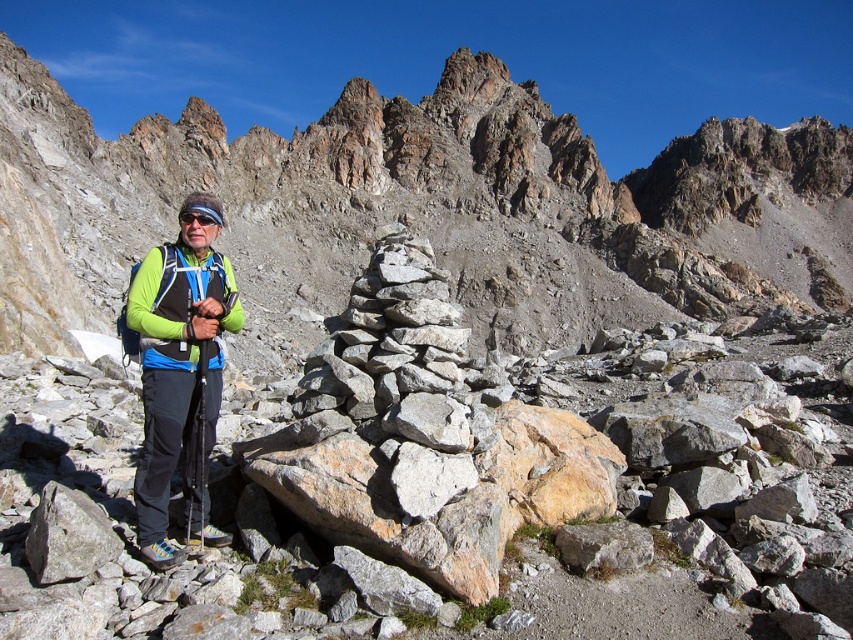
Who is more forward, (212, 262) or (184, 220)?

Point (184, 220) is in front.

I want to click on green matte jacket at center, so click(x=178, y=372).

Is green matte jacket at left to the right of black matte goggles at center from the viewer's perspective?

Correct, you'll find green matte jacket at left to the right of black matte goggles at center.

The width and height of the screenshot is (853, 640). What are the coordinates of `green matte jacket at left` in the screenshot? It's located at (170, 301).

Where is `green matte jacket at left`? This screenshot has height=640, width=853. green matte jacket at left is located at coordinates (170, 301).

Does green matte jacket at center have a greater height compared to green matte jacket at left?

Yes, green matte jacket at center is taller than green matte jacket at left.

Who is shorter, green matte jacket at center or green matte jacket at left?

With less height is green matte jacket at left.

Is point (167, 394) more distant than point (131, 285)?

No, (167, 394) is in front of (131, 285).

This screenshot has height=640, width=853. In order to click on green matte jacket at center in this screenshot , I will do `click(178, 372)`.